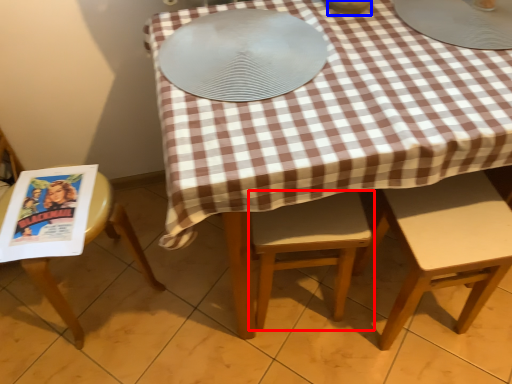
Question: Which object is further to the camera taking this photo, chair (highlighted by a red box) or tableware (highlighted by a blue box)?

Choices:
 (A) chair
 (B) tableware

Answer: (A)